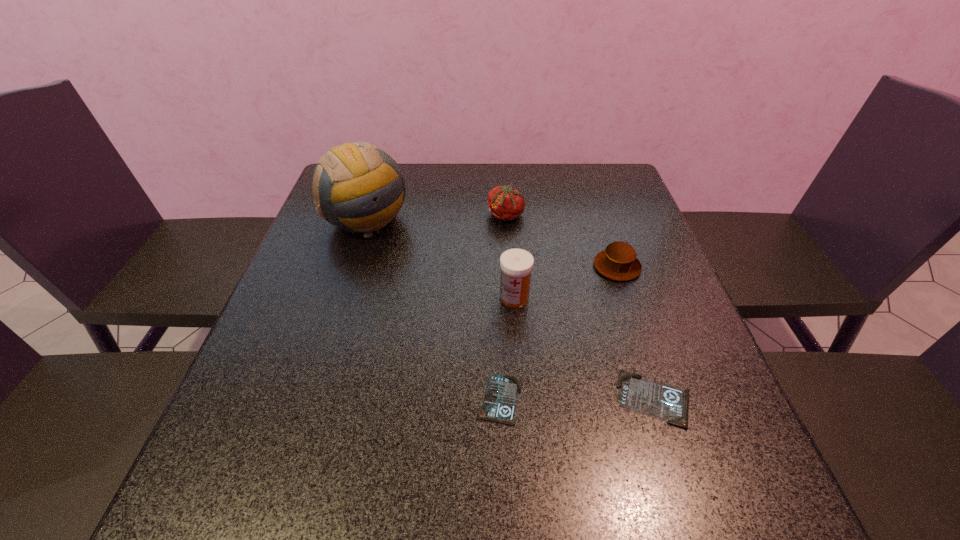
Where is `identity card located in the right edge section of the desktop`? The height and width of the screenshot is (540, 960). identity card located in the right edge section of the desktop is located at coordinates (648, 397).

Where is `muffin at the right edge`? This screenshot has height=540, width=960. muffin at the right edge is located at coordinates (618, 261).

The width and height of the screenshot is (960, 540). What are the coordinates of `object situated at the far left corner` in the screenshot? It's located at (359, 187).

This screenshot has height=540, width=960. What are the coordinates of `object that is positioned at the near right corner` in the screenshot? It's located at (648, 397).

Locate an element on the screen. The width and height of the screenshot is (960, 540). vacant space at the far edge of the desktop is located at coordinates (545, 200).

Identify the location of vacant space at the left edge of the desktop. (323, 347).

Locate an element on the screen. free space at the right edge of the desktop is located at coordinates 644,268.

I want to click on vacant space at the far right corner of the desktop, so click(x=631, y=195).

Where is `vacant region between the third farthest object and the leftmost object`? The width and height of the screenshot is (960, 540). vacant region between the third farthest object and the leftmost object is located at coordinates (492, 243).

You are a GUI agent. You are given a task and a screenshot of the screen. Output one action in this format:
    pyautogui.click(x=<x>, y=<y>)
    Task: Click on the unoccupied area between the second tallest object and the fourth nearest object
    
    Given the screenshot: What is the action you would take?
    pyautogui.click(x=565, y=282)